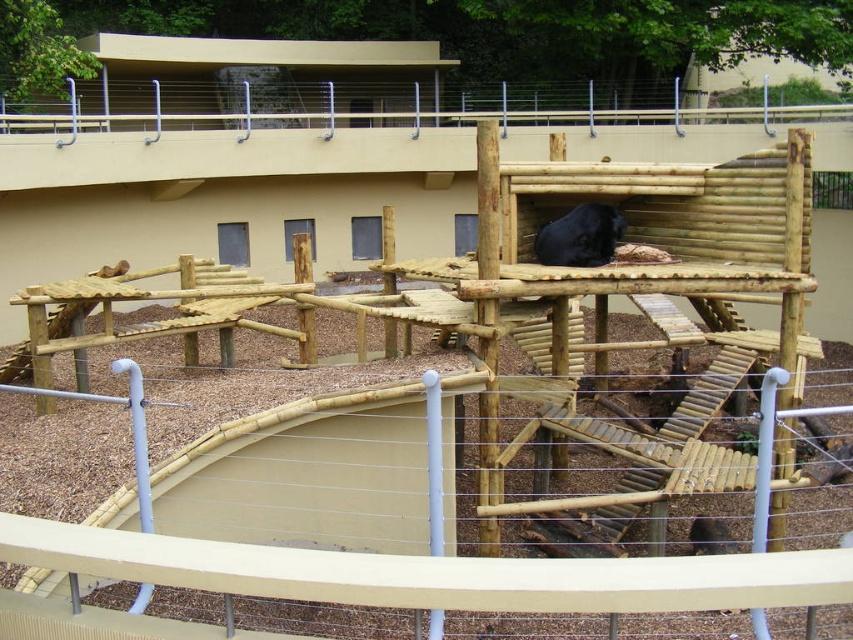
Question: Which of the following is the closest to the observer?

Choices:
 (A) wooden fence at lower center
 (B) black fur/black coat at center

Answer: (A)

Question: Is wooden fence at lower center to the right of black fur/black coat at center from the viewer's perspective?

Choices:
 (A) yes
 (B) no

Answer: (B)

Question: Which object appears farthest from the camera in this image?

Choices:
 (A) wooden fence at lower center
 (B) black fur/black coat at center

Answer: (B)

Question: Is wooden fence at lower center wider than black fur/black coat at center?

Choices:
 (A) no
 (B) yes

Answer: (B)

Question: From the image, what is the correct spatial relationship of wooden fence at lower center in relation to black fur/black coat at center?

Choices:
 (A) left
 (B) right

Answer: (A)